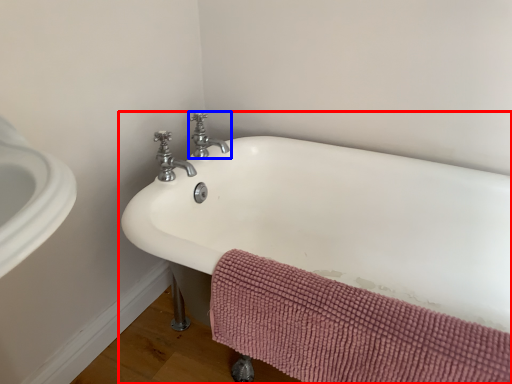
Question: Among these objects, which one is nearest to the camera, bathtub (highlighted by a red box) or tap (highlighted by a blue box)?

Choices:
 (A) bathtub
 (B) tap

Answer: (A)